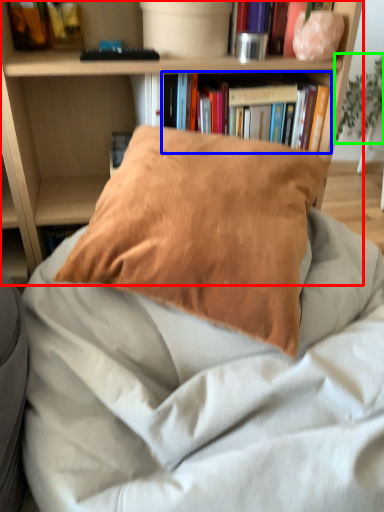
Question: Which object is the farthest from bookcase (highlighted by a red box)? Choose among these: book (highlighted by a blue box) or plant (highlighted by a green box).

Choices:
 (A) book
 (B) plant

Answer: (B)